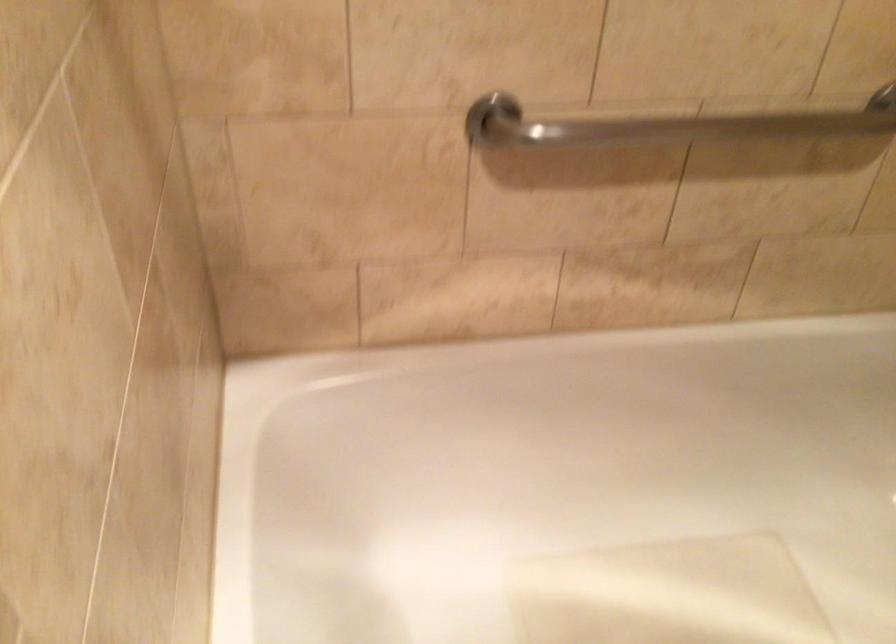
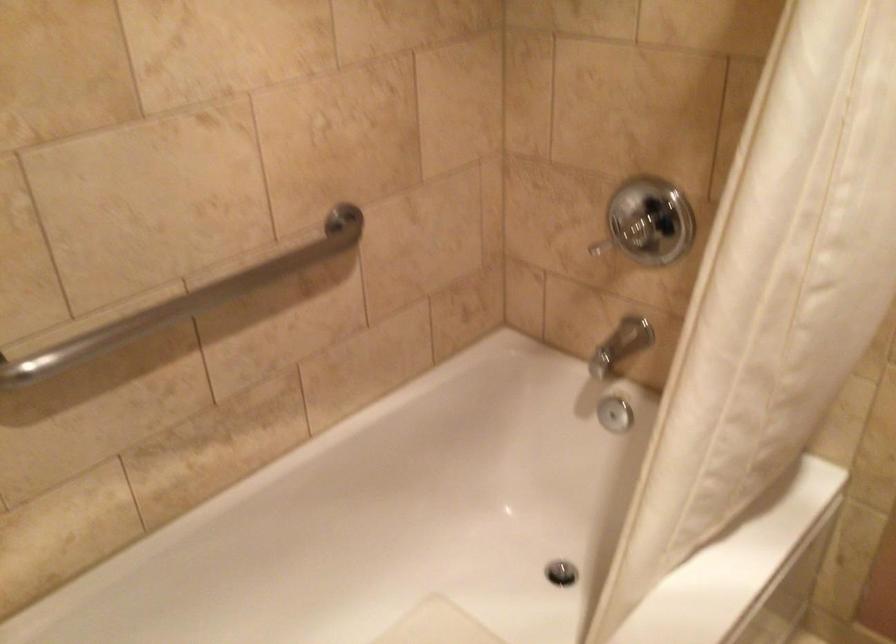
Question: The camera is either moving clockwise (left) or counter-clockwise (right) around the object. The first image is from the beginning of the video and the second image is from the end. Is the camera moving left or right when shooting the video?

Choices:
 (A) Left
 (B) Right

Answer: (A)